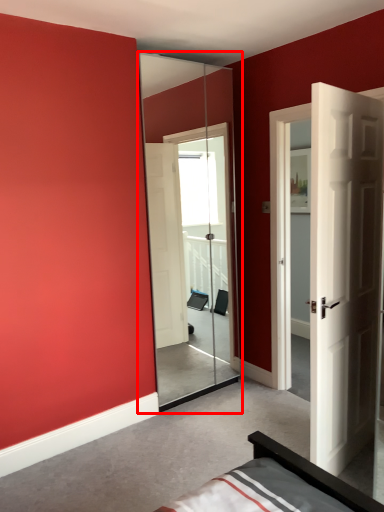
Question: Considering the relative positions of screen door (annotated by the red box) and door in the image provided, where is screen door (annotated by the red box) located with respect to the staircase?

Choices:
 (A) left
 (B) right

Answer: (A)